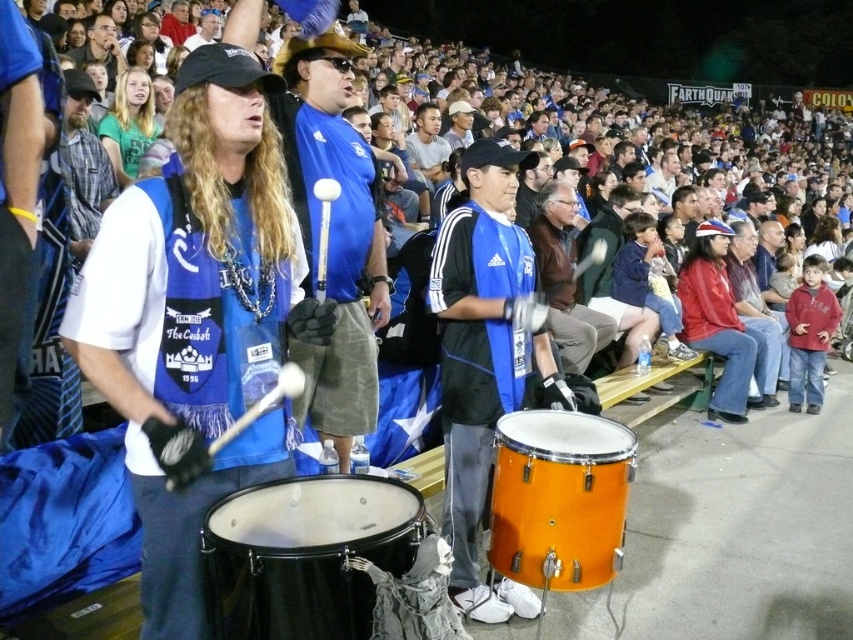
Who is lower down, red leather jacket at right or light brown hair at upper center?

red leather jacket at right

Between red leather jacket at right and light brown hair at upper center, which one is positioned higher?

light brown hair at upper center is above.

Is point (743, 397) farther from viewer compared to point (126, 179)?

Yes, it is behind point (126, 179).

Image resolution: width=853 pixels, height=640 pixels. I want to click on red leather jacket at right, so click(718, 321).

Looking at this image, does blue jersey at center have a lesser width compared to light brown hair at upper center?

Indeed, blue jersey at center has a lesser width compared to light brown hair at upper center.

Does blue jersey at center appear on the right side of light brown hair at upper center?

Indeed, blue jersey at center is positioned on the right side of light brown hair at upper center.

Which is in front, point (357, 275) or point (123, 157)?

Point (357, 275) is more forward.

Identify the location of blue jersey at center. [x=334, y=236].

Does black drum at center have a greater width compared to light brown hair at upper center?

Indeed, black drum at center has a greater width compared to light brown hair at upper center.

Between black drum at center and light brown hair at upper center, which one is positioned lower?

Positioned lower is black drum at center.

Where is `black drum at center`? black drum at center is located at coordinates coord(306,554).